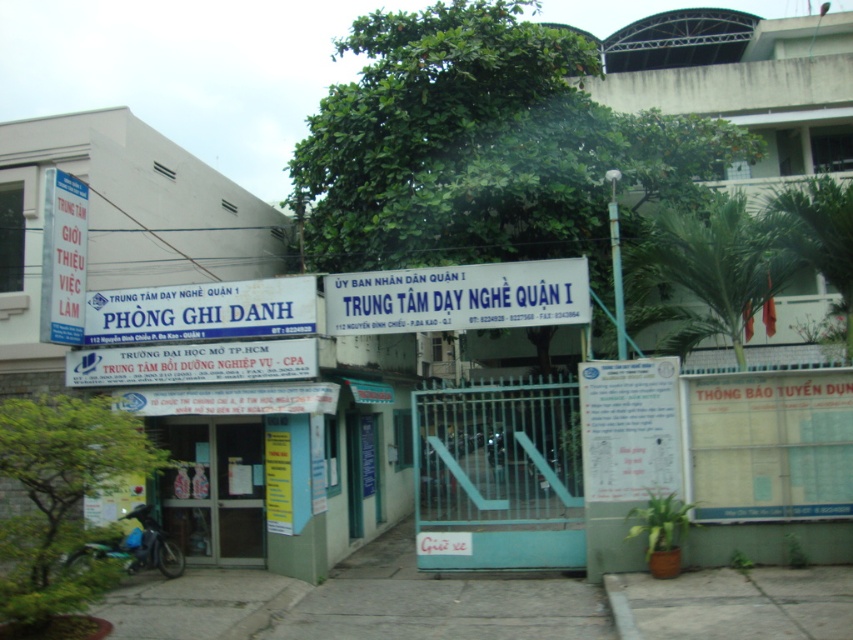
You are a delivery person arriving at the Trung T am D ay Ngh e Qu n 1 Vocational Training Center entrance. You need to park your motorcycle on the gray concrete pavement at center or gray concrete pavement at lower center. Which pavement area is bigger and can accommodate your motorcycle better?

The gray concrete pavement at center has a larger size compared to gray concrete pavement at lower center, so it can accommodate your motorcycle better.

Looking at this image, you are a visitor arriving at the Trung Tam Day Nghiep Quan 1. You see the gray concrete pavement at center and the white plastic sign at center. Which object is larger in size?

The gray concrete pavement at center is bigger than the white plastic sign at center.

You are a delivery person approaching the entrance of Trung T?m D?y Ngh?e Qu?n 1. You need to park your motorcycle on the gray concrete pavement at center and the gray concrete pavement at lower center. Which pavement has enough space to accommodate your motorcycle?

The gray concrete pavement at center has a larger width than the gray concrete pavement at lower center, so it can accommodate your motorcycle more comfortably.